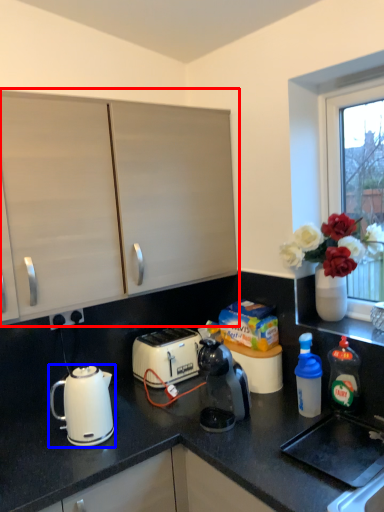
Question: Which point is further to the camera, cabinetry (highlighted by a red box) or kettle (highlighted by a blue box)?

Choices:
 (A) cabinetry
 (B) kettle

Answer: (B)